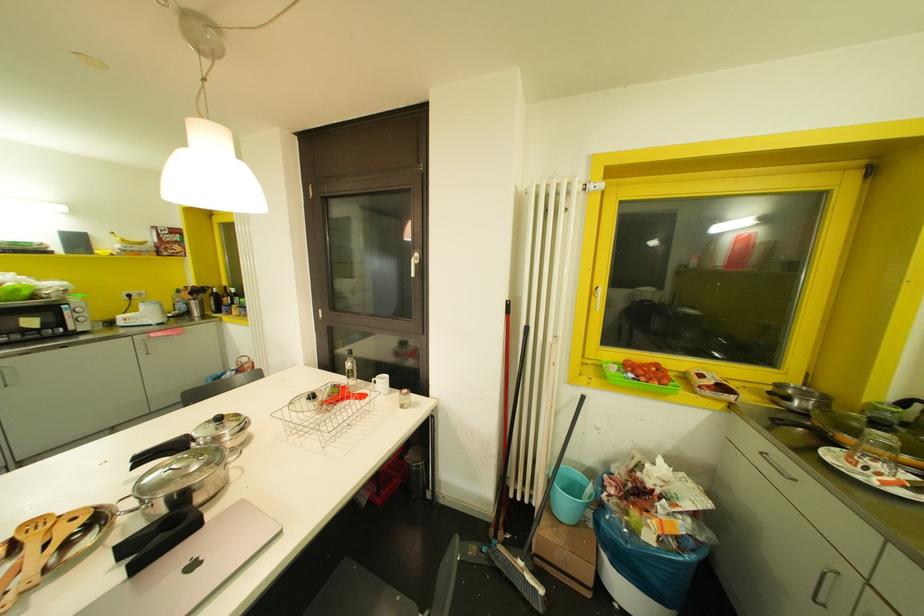
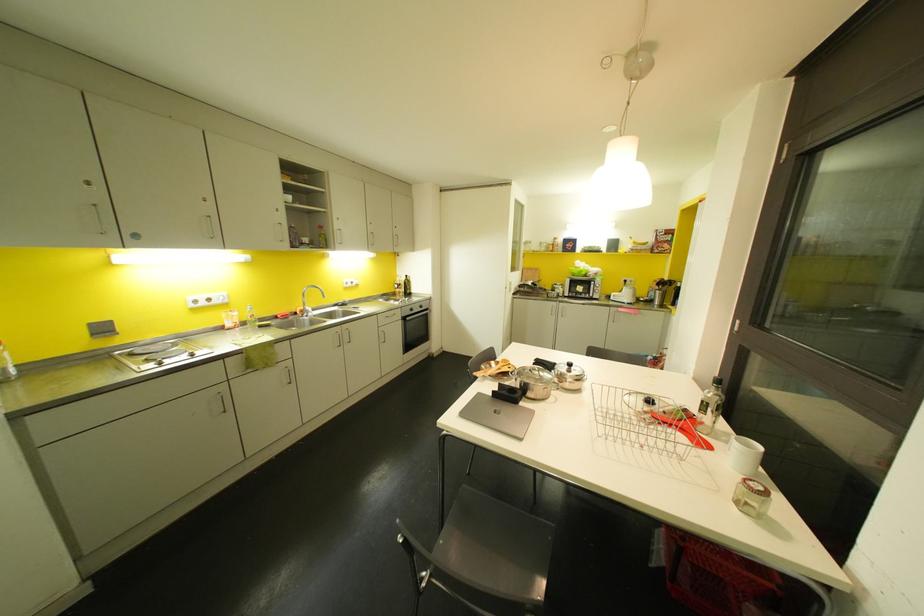
In the second image, find the point that corresponds to (219,418) in the first image.

(569, 363)